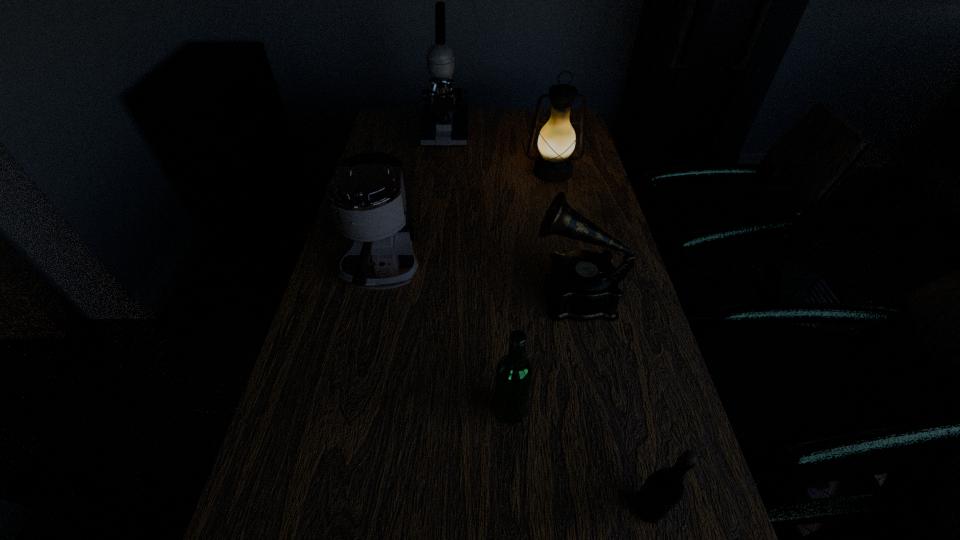
What are the coordinates of `vacant space that satisfies the following two spatial constraints: 1. on the front-facing side of the coffee maker; 2. on the right side of the third object from left to right` in the screenshot? It's located at (352, 410).

You are a GUI agent. You are given a task and a screenshot of the screen. Output one action in this format:
    pyautogui.click(x=<x>, y=<y>)
    Task: Click on the free space that satisfies the following two spatial constraints: 1. on the front side of the right beer bottle; 2. on the left side of the farthest object
    The image size is (960, 540).
    Given the screenshot: What is the action you would take?
    pyautogui.click(x=403, y=508)

This screenshot has width=960, height=540. I want to click on free spot that satisfies the following two spatial constraints: 1. on the horn of the phonograph record; 2. on the back side of the nearer beer bottle, so click(x=621, y=508).